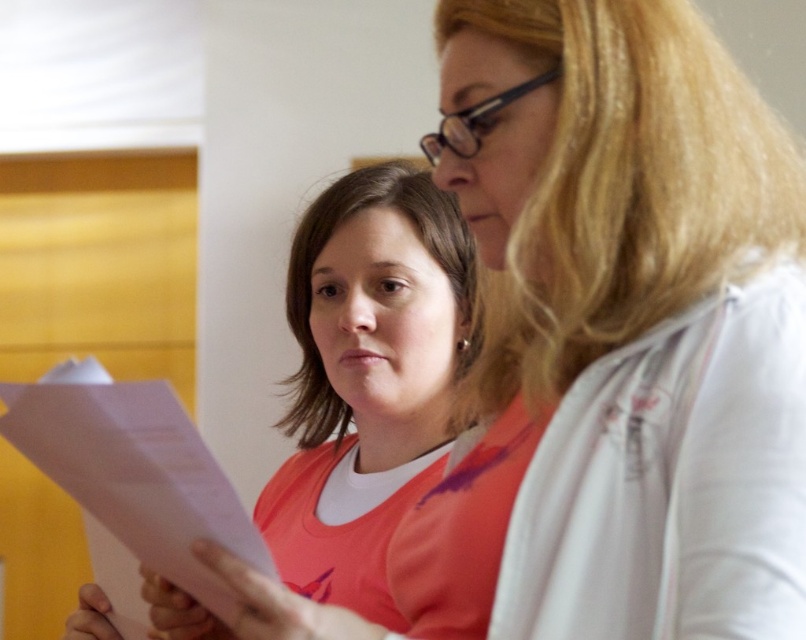
Is point (381, 472) farther from viewer compared to point (202, 484)?

That is True.

Looking at this image, who is positioned more to the left, pink matte paper at center or pink paper at lower left?

From the viewer's perspective, pink paper at lower left appears more on the left side.

The width and height of the screenshot is (806, 640). What do you see at coordinates (368, 378) in the screenshot?
I see `pink matte paper at center` at bounding box center [368, 378].

This screenshot has width=806, height=640. In order to click on pink matte paper at center in this screenshot , I will do `click(368, 378)`.